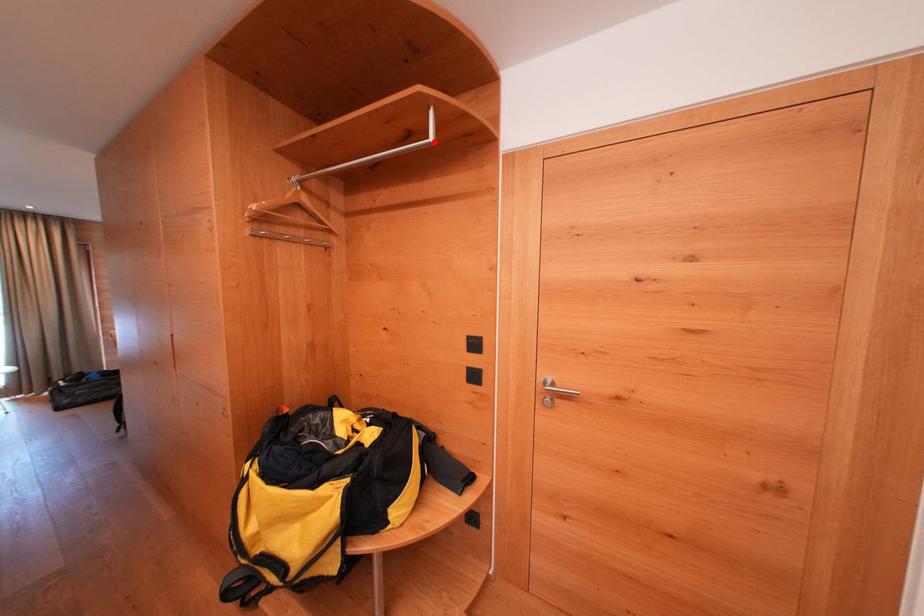
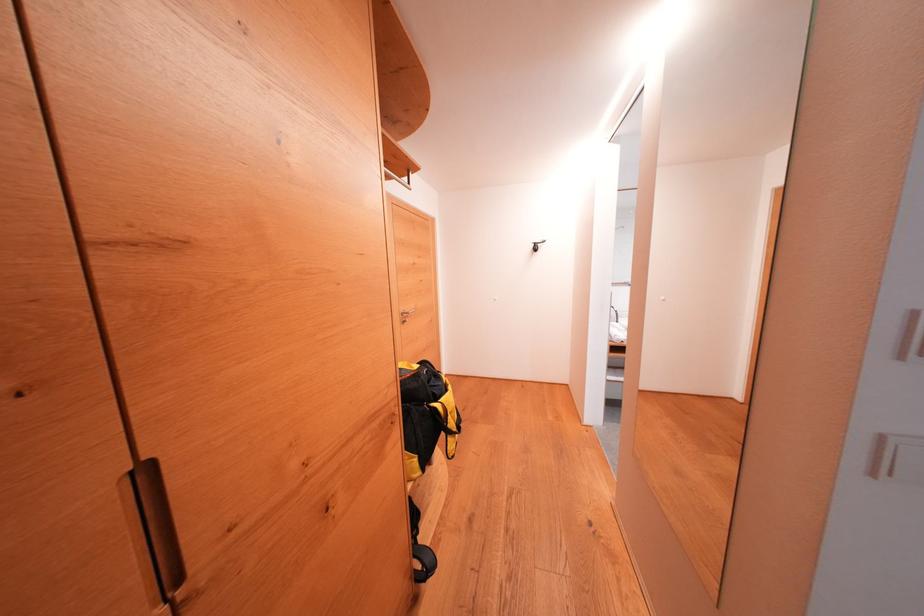
Question: I am providing you with two images of the same scene from different viewpoints. A red point is marked on the first image. Is the red point's position out of view in image 2?

Choices:
 (A) Yes
 (B) No

Answer: (A)